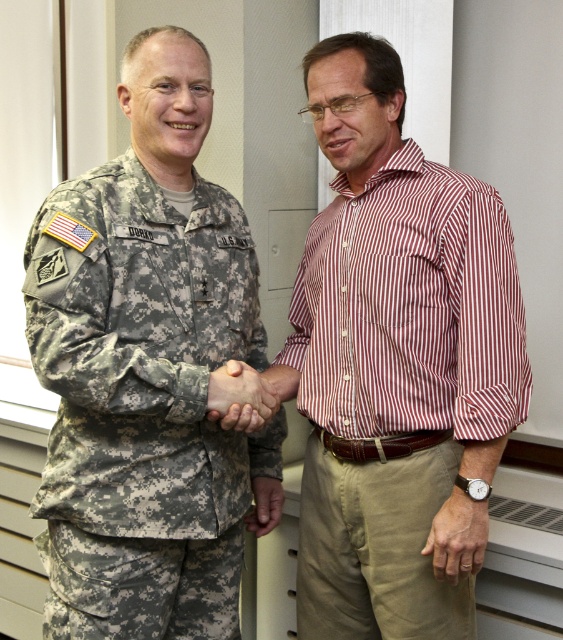
Question: Is camouflage fabric uniform at left positioned in front of camouflage fabric hand at center?

Choices:
 (A) yes
 (B) no

Answer: (A)

Question: Which object appears closest to the camera in this image?

Choices:
 (A) camouflage fabric uniform at left
 (B) camouflage fabric hand at center
 (C) striped cotton shirt at center

Answer: (A)

Question: Does striped cotton shirt at center appear over camouflage fabric hand at center?

Choices:
 (A) yes
 (B) no

Answer: (A)

Question: Which point appears farthest from the camera in this image?

Choices:
 (A) (369, 248)
 (B) (222, 371)

Answer: (A)

Question: Which object is positioned farthest from the camouflage fabric uniform at left?

Choices:
 (A) striped cotton shirt at center
 (B) camouflage fabric hand at center

Answer: (A)

Question: In this image, where is camouflage fabric uniform at left located relative to camouflage fabric hand at center?

Choices:
 (A) left
 (B) right

Answer: (A)